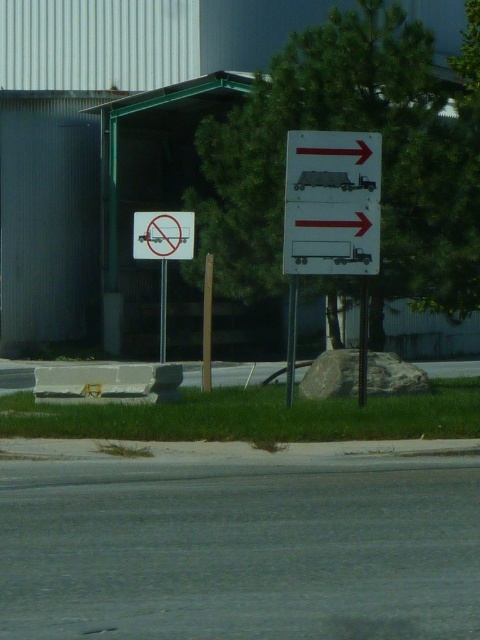
Who is taller, white plastic sign at center or metallic pole at center?

metallic pole at center

Which is behind, point (158, 212) or point (287, 344)?

The point (287, 344) is more distant.

Locate an element on the screen. The width and height of the screenshot is (480, 640). white plastic sign at center is located at coordinates (163, 236).

Which of these two, metallic pole at center or brushed metal pole at left, stands taller?

With more height is brushed metal pole at left.

Does metallic pole at center have a greater height compared to brushed metal pole at left?

In fact, metallic pole at center may be shorter than brushed metal pole at left.

I want to click on metallic pole at center, so click(290, 339).

Can you confirm if white plastic sign at center is positioned below brushed metal pole at left?

Incorrect, white plastic sign at center is not positioned below brushed metal pole at left.

Who is shorter, white plastic sign at center or brushed metal pole at left?

Standing shorter between the two is white plastic sign at center.

Is point (171, 253) behind point (162, 330)?

No, it is in front of (162, 330).

Locate an element on the screen. Image resolution: width=480 pixels, height=640 pixels. white plastic sign at center is located at coordinates (163, 236).